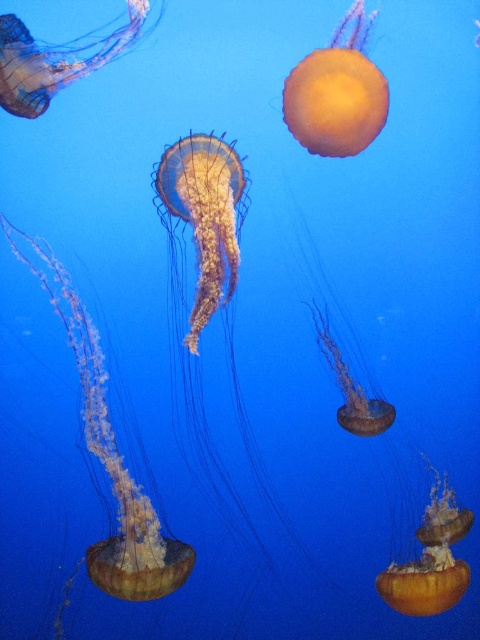
Is point (126, 554) farther from viewer compared to point (46, 52)?

Yes, it is behind point (46, 52).

What do you see at coordinates (109, 460) in the screenshot?
I see `translucent yellow jellyfish at left` at bounding box center [109, 460].

Where is `translucent yellow jellyfish at left`? Image resolution: width=480 pixels, height=640 pixels. translucent yellow jellyfish at left is located at coordinates (109, 460).

Is translucent orange jellyfish at upper right thinner than translucent orange jellyfish at lower right?

Incorrect, translucent orange jellyfish at upper right's width is not less than translucent orange jellyfish at lower right's.

How far apart are translucent orange jellyfish at upper right and translucent orange jellyfish at lower right?

The distance of translucent orange jellyfish at upper right from translucent orange jellyfish at lower right is 84.26 centimeters.

Between point (345, 72) and point (417, 592), which one is positioned behind?

Point (345, 72)

The image size is (480, 640). In order to click on translucent orange jellyfish at upper right in this screenshot , I will do `click(336, 93)`.

Based on the photo, can you confirm if translucent orange jellyfish at upper right is positioned to the left of translucent orange jellyfish at center?

Incorrect, translucent orange jellyfish at upper right is not on the left side of translucent orange jellyfish at center.

Is point (356, 77) farther from camera compared to point (289, 188)?

No, (356, 77) is in front of (289, 188).

Looking at this image, who is more distant from viewer, [364,35] or [319,342]?

The point [319,342] is more distant.

Locate an element on the screen. This screenshot has width=480, height=640. translucent orange jellyfish at upper right is located at coordinates (336, 93).